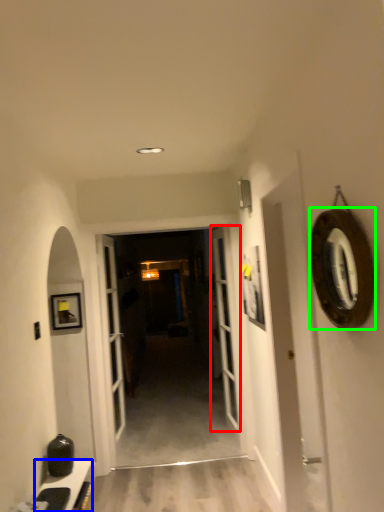
Question: Considering the real-world distances, which object is closest to door (highlighted by a red box)? cabinetry (highlighted by a blue box) or oval (highlighted by a green box).

Choices:
 (A) cabinetry
 (B) oval

Answer: (A)